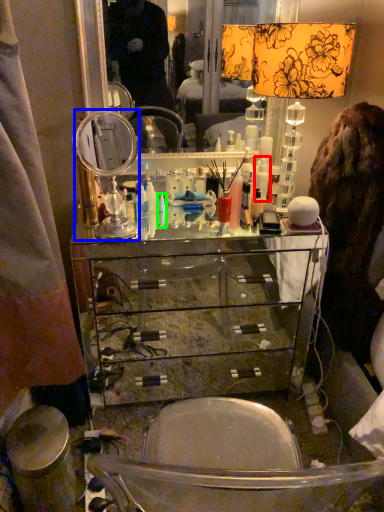
Question: Which is farther away from toiletry (highlighted by a red box)? table lamp (highlighted by a blue box) or toiletry (highlighted by a green box)?

Choices:
 (A) table lamp
 (B) toiletry

Answer: (A)